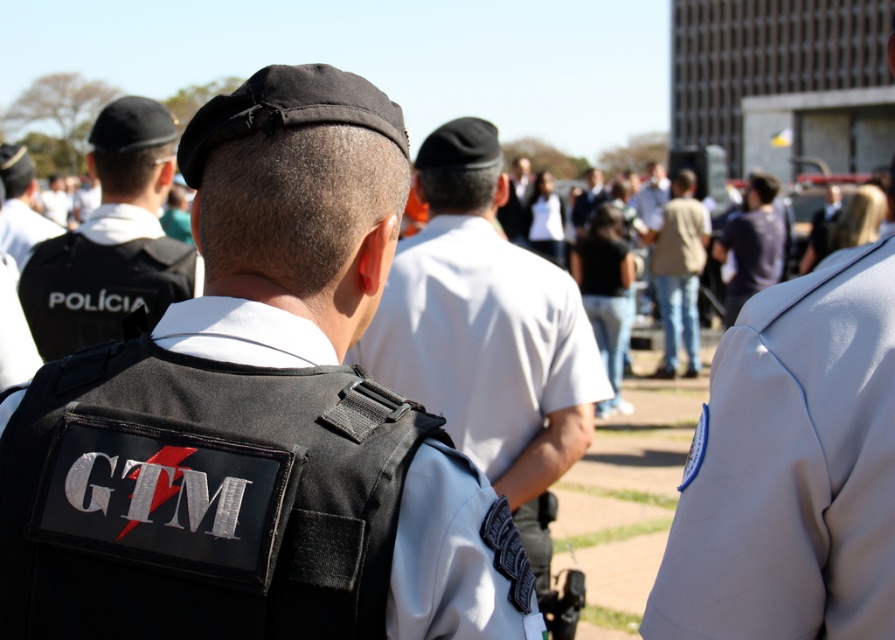
Based on the photo, is black tactical vest at center shorter than black matte vest at left?

Yes.

Based on the photo, is black tactical vest at center positioned in front of black matte vest at left?

That is True.

Does point (232, 372) come closer to viewer compared to point (61, 289)?

Yes.

Locate an element on the screen. The image size is (895, 640). black tactical vest at center is located at coordinates (257, 419).

Between point (262, 544) and point (751, 182), which one is positioned behind?

Point (751, 182)

Between black tactical vest at center and dark blue shirt at center, which one has more height?

dark blue shirt at center is taller.

This screenshot has height=640, width=895. Find the location of `black tactical vest at center`. black tactical vest at center is located at coordinates (257, 419).

Can you confirm if dark blue shirt at center is bigger than white uniform at center?

No.

Who is more forward, (729, 280) or (9, 216)?

Point (9, 216) is in front.

Between point (761, 189) and point (6, 240), which one is positioned in front?

Point (6, 240)

Find the location of a particular element. Image resolution: width=895 pixels, height=640 pixels. dark blue shirt at center is located at coordinates (751, 244).